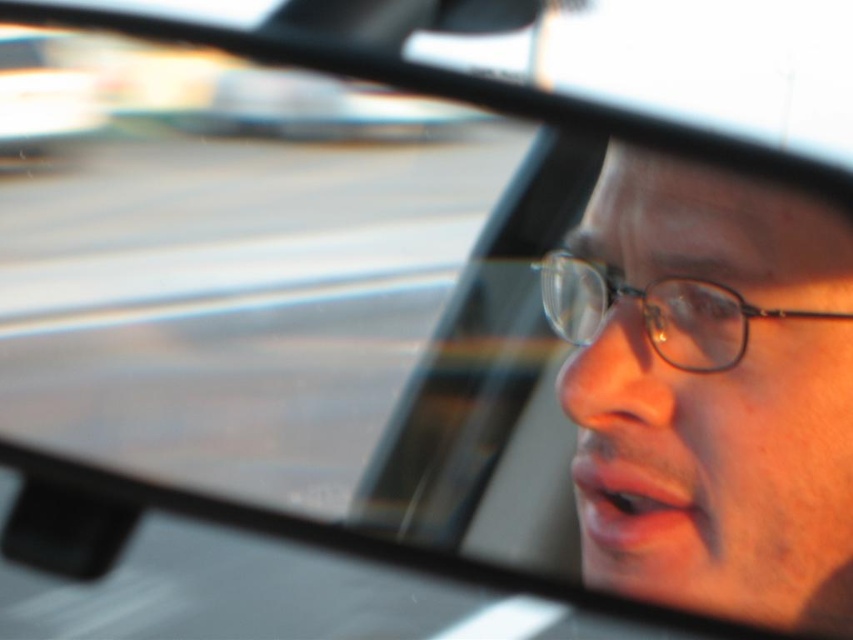
Can you confirm if clear plastic glasses at right is thinner than clear plastic glasses at center?

Incorrect, clear plastic glasses at right's width is not less than clear plastic glasses at center's.

Does clear plastic glasses at right have a smaller size compared to clear plastic glasses at center?

No, clear plastic glasses at right is not smaller than clear plastic glasses at center.

At what (x,y) coordinates should I click in order to perform the action: click on clear plastic glasses at right. Please return your answer as a coordinate pair (x, y). The width and height of the screenshot is (853, 640). Looking at the image, I should click on (709, 392).

At what (x,y) coordinates should I click in order to perform the action: click on clear plastic glasses at right. Please return your answer as a coordinate pair (x, y). Image resolution: width=853 pixels, height=640 pixels. Looking at the image, I should click on (709, 392).